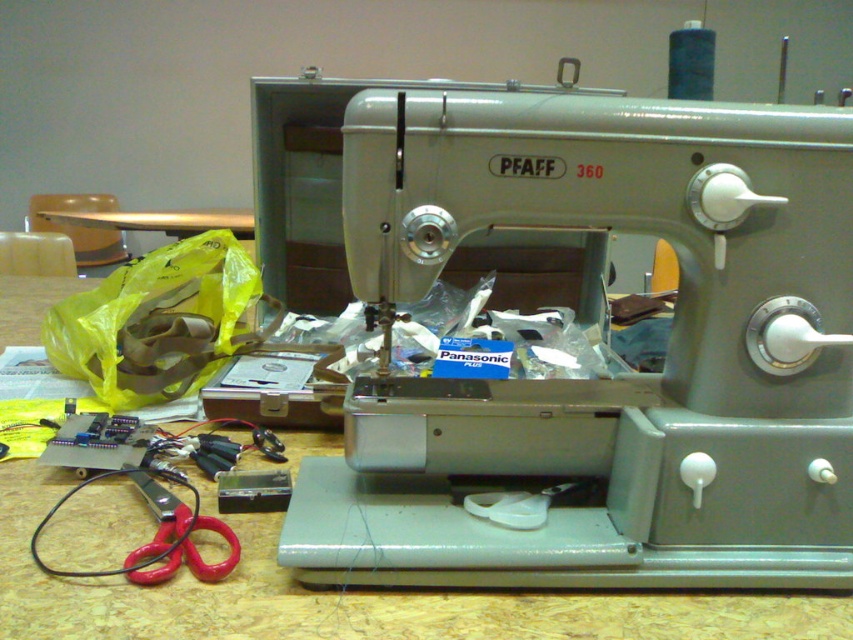
You are a repair technician working on a vintage Pfaff 360 sewing machine. You need to place a new circuit board on the wooden table at center. Where exactly should you place it?

The wooden table at center is located at point (352, 596), so you should place the new circuit board there.